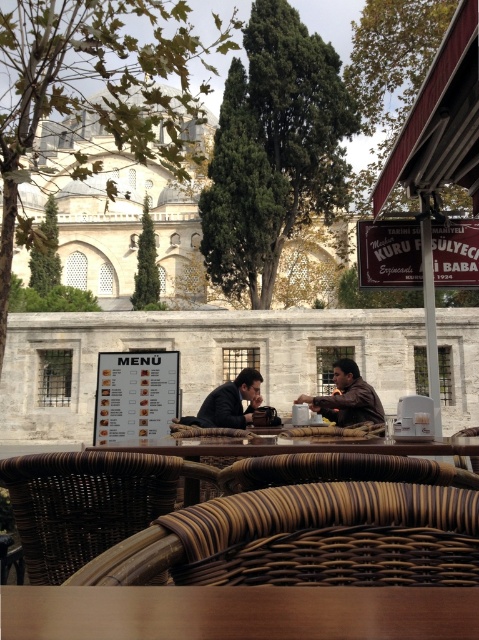
Between wooden table at center and brown woven table at center, which one has more height?

brown woven table at center is taller.

Between wooden table at center and brown woven table at center, which one is positioned higher?

Positioned higher is wooden table at center.

This screenshot has height=640, width=479. What do you see at coordinates (238, 612) in the screenshot? I see `wooden table at center` at bounding box center [238, 612].

Identify the location of wooden table at center. Image resolution: width=479 pixels, height=640 pixels. (238, 612).

At what (x,y) coordinates should I click in order to perform the action: click on brown woven table at center. Please return your answer as a coordinate pair (x, y). The height and width of the screenshot is (640, 479). Looking at the image, I should click on (324, 452).

Does brown woven table at center have a lesser height compared to matte black clothing at center?

Incorrect, brown woven table at center's height does not fall short of matte black clothing at center's.

Does point (339, 465) come in front of point (329, 400)?

Yes, it is in front of point (329, 400).

You are a GUI agent. You are given a task and a screenshot of the screen. Output one action in this format:
    pyautogui.click(x=<x>, y=<y>)
    Task: Click on the brown woven table at center
    
    Given the screenshot: What is the action you would take?
    pyautogui.click(x=324, y=452)

Does matte black clothing at center appear under brown leather jacket at center?

Yes, matte black clothing at center is below brown leather jacket at center.

Which is more to the left, matte black clothing at center or brown leather jacket at center?

From the viewer's perspective, matte black clothing at center appears more on the left side.

Is point (349, 413) more distant than point (376, 406)?

No, it is in front of (376, 406).

The height and width of the screenshot is (640, 479). Identify the location of matte black clothing at center. (346, 397).